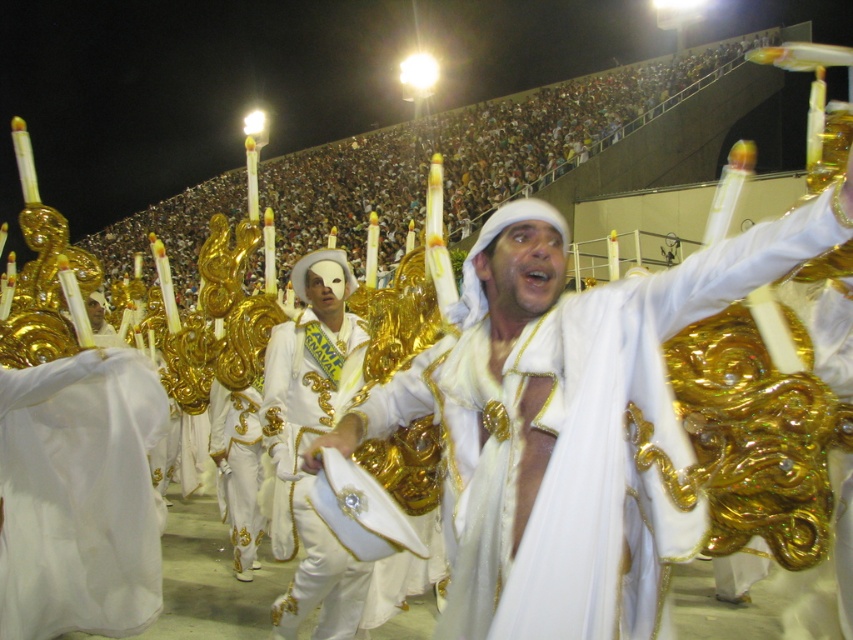
You are a photographer at the carnival event. You want to capture a photo of both the white satin robe at center and the white satin robe at lower left. Which robe should you focus on first to ensure both are in the frame?

The white satin robe at center is much taller than the white satin robe at lower left. To ensure both are in the frame, focus on the taller white satin robe at center first, then adjust the camera angle to include the shorter one.

You are a photographer positioned at the origin point in the image. The white satin robe at center is at coordinates 0.681, 0.739. If you want to capture the robe in your shot, which direction should you move your camera? Please specify the direction based on the coordinate system where the origin is at the bottom left corner of the image.

The white satin robe at center is located at point (630, 435). Since the origin is at the bottom left corner, the coordinates indicate that the robe is to the upper right of the origin. Therefore, you should move the camera towards the upper right direction to capture the robe.

You are a photographer at the carnival. You want to capture the white satin robe at center in your photo. The point you marked at coordinate point (630, 435) is part of this robe. Is the point on the robe?

Yes, the point (630, 435) is on the white satin robe at center.